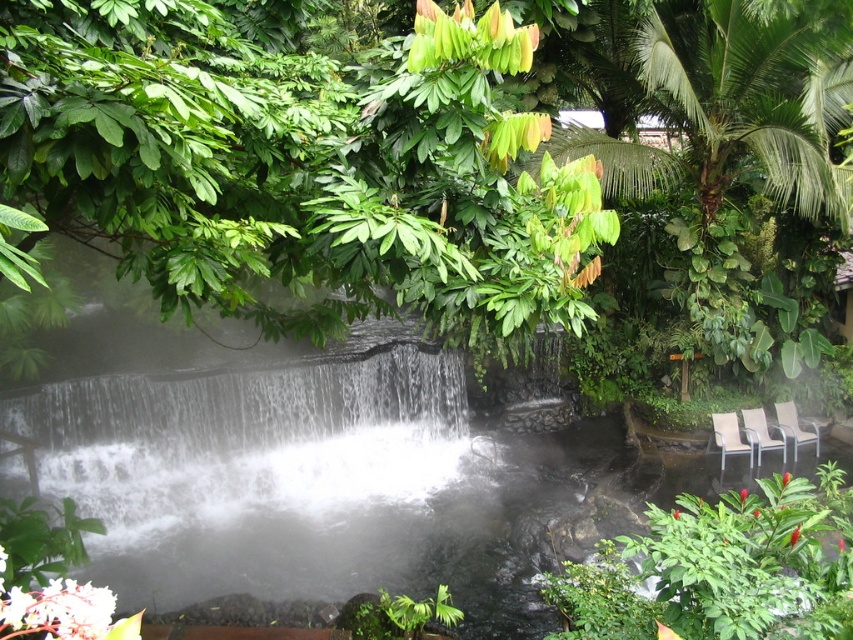
Find the location of a particular element. The height and width of the screenshot is (640, 853). green leafy tree at upper center is located at coordinates (293, 168).

Which is in front, point (149, 260) or point (801, 444)?

Point (149, 260) is more forward.

Between point (32, 16) and point (796, 442), which one is positioned in front?

Point (32, 16) is more forward.

The width and height of the screenshot is (853, 640). In order to click on green leafy tree at upper center in this screenshot , I will do `click(293, 168)`.

Is brown woven chair at lower right positioned before metallic silver chair at lower right?

Yes, it is in front of metallic silver chair at lower right.

Is brown woven chair at lower right to the left of metallic silver chair at lower right from the viewer's perspective?

Indeed, brown woven chair at lower right is positioned on the left side of metallic silver chair at lower right.

Who is more distant from viewer, (x=738, y=428) or (x=775, y=428)?

The point (x=775, y=428) is more distant.

I want to click on brown woven chair at lower right, so (x=729, y=436).

Which of these two, green leafy tree at upper center or brown woven chair at lower right, stands taller?

Standing taller between the two is green leafy tree at upper center.

In the scene shown: Which is more to the right, green leafy tree at upper center or brown woven chair at lower right?

Positioned to the right is brown woven chair at lower right.

Identify the location of green leafy tree at upper center. tap(293, 168).